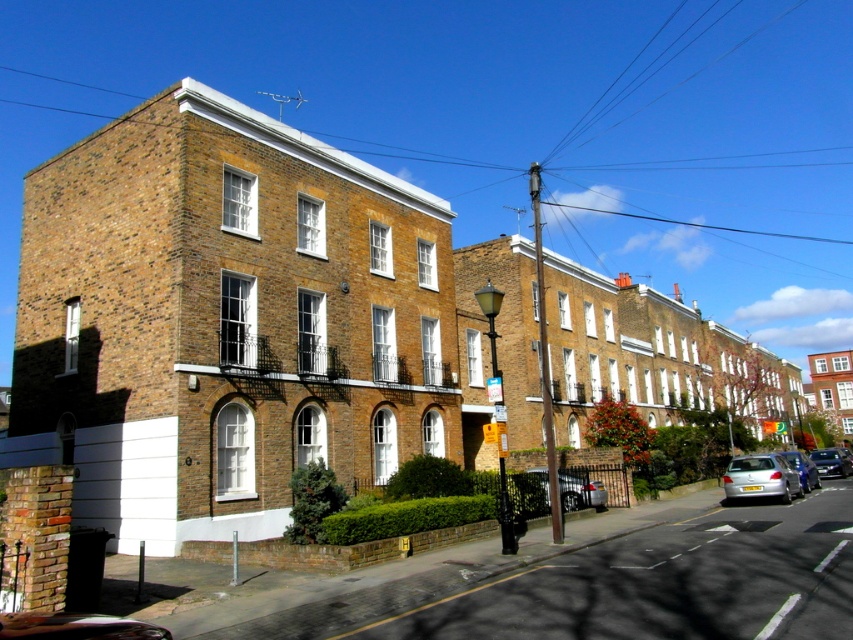
You are a delivery person standing on the sidewalk in front of the row of brick buildings. You need to deliver a package to the apartment above the metallic silver sedan at lower right. Which car should you look for? Is it the one above or below the metallic silver car at lower right?

The metallic silver sedan at lower right is below the metallic silver car at lower right. Therefore, the apartment above the metallic silver sedan at lower right would be located above the lower positioned car. So you should look for the apartment above the metallic silver sedan at lower right, which is the lower car, not the one above the higher positioned metallic silver car at lower right.

You are a delivery person trying to reach the entrance of the building. You see the silver metallic car at lower right and the metallic silver car at lower right. Which car should you move first to access the entrance?

The silver metallic car at lower right is in front of the metallic silver car at lower right, so you should move the silver metallic car at lower right first to access the entrance.

You are a delivery person with a cart that is 3 meters wide. You need to navigate between the silver metallic car at lower right and the metallic silver car at lower right. Can your cart fit through the space between them?

The distance between the silver metallic car at lower right and the metallic silver car at lower right is 2.92 meters. Since your cart is 3 meters wide, it cannot fit through the space between them as the available space is slightly narrower than the cart.